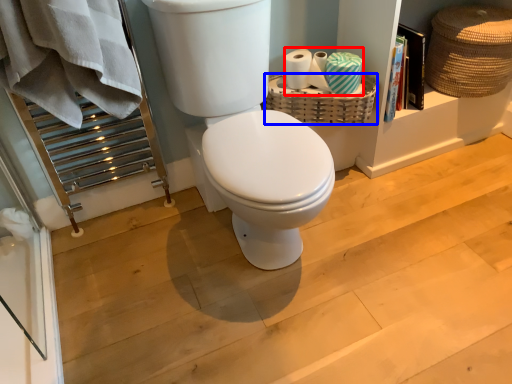
Question: Which of the following is the farthest to the observer, toilet paper (highlighted by a red box) or basket (highlighted by a blue box)?

Choices:
 (A) toilet paper
 (B) basket

Answer: (B)